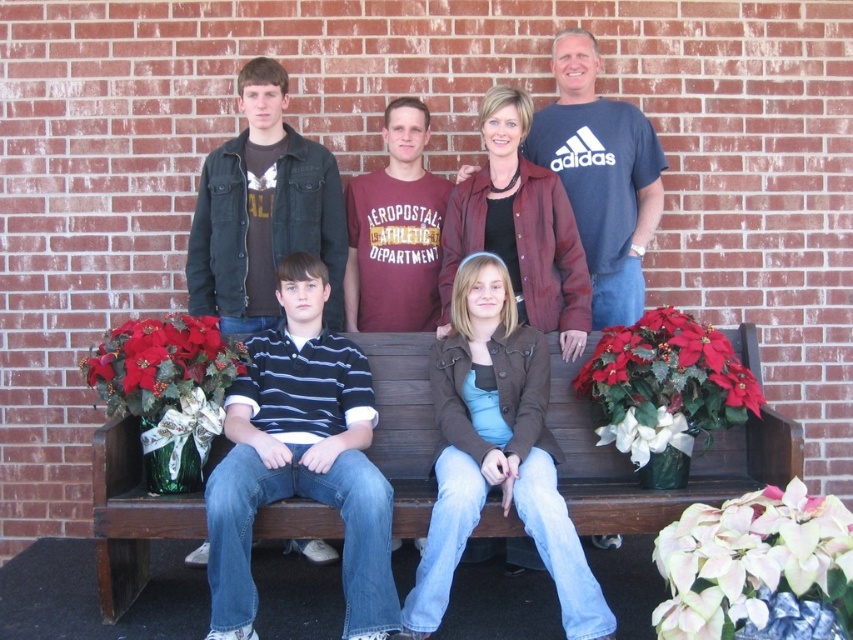
You are a photographer trying to capture a closeup of the blue striped polo shirt at center and the silky red poinsettia at left. Which object should you zoom in on first to ensure it appears larger in the frame?

The blue striped polo shirt at center is larger in size than the silky red poinsettia at left, so you should zoom in on the blue striped polo shirt at center first to ensure it appears larger in the frame.

You are a photographer setting up for a group photo. You notice the red velvet poinsettia at center and the silky red poinsettia at left. Which of these two plants is positioned lower in the scene?

The red velvet poinsettia at center is positioned lower because it is below the silky red poinsettia at left.

You are a photographer setting up for a group photo. You need to ensure that the brown leather jacket at center and the red velvet poinsettia at center are both visible in the frame. Given their sizes, which object might require more space in the composition?

The brown leather jacket at center is bigger than the red velvet poinsettia at center, so it might require more space in the composition to ensure it is fully visible.